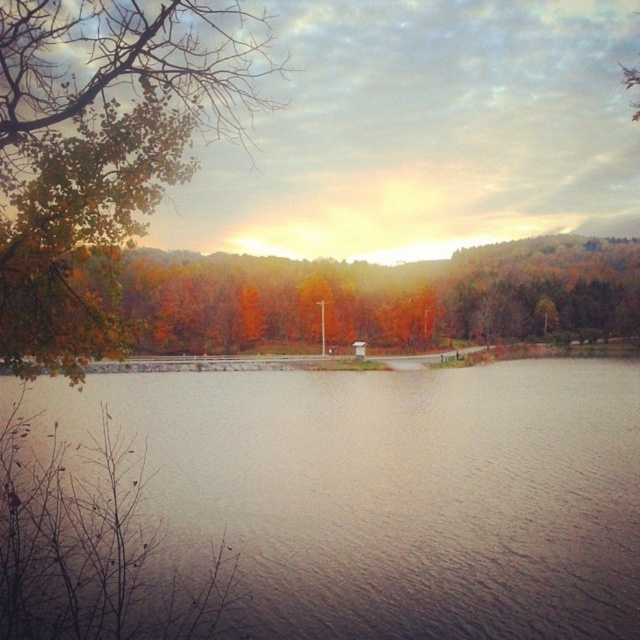
You are a photographer planning to capture the autumn scene. You want to ensure both the green matte tree at upper left and the autumn leaves at center are in your shot. Which object should you focus on first to ensure both are in frame?

The green matte tree at upper left is taller than autumn leaves at center, so focusing on the taller green matte tree at upper left first will help ensure both objects are within the frame.

You are standing at the edge of the smooth water at center in the autumn landscape. You want to walk straight towards the green matte tree at upper left. How far will you have to walk to reach it?

The smooth water at center is 14.86 meters away from the green matte tree at upper left, so you will have to walk approximately 14.86 meters to reach it.

You are an artist planning to paint the scene. You want to place the smooth water at center and the green matte tree at upper left in your painting. According to the image, which object should be placed to the right of the other?

The smooth water at center is positioned on the right side of green matte tree at upper left, so the smooth water at center should be placed to the right of the green matte tree at upper left.